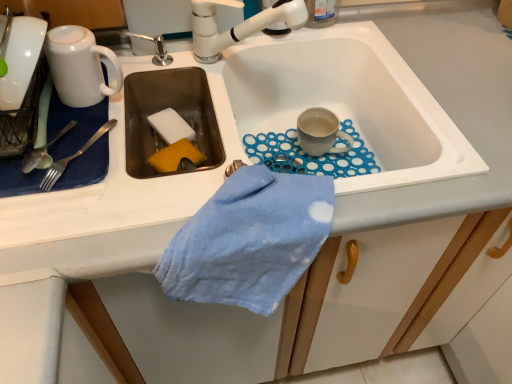
Question: Considering the relative positions of satin silver fork at left, which is the third silverware from left to right, and matte gray mug at sink right, acting as the 1th coffee cup starting from the back, in the image provided, is satin silver fork at left, which is the third silverware from left to right, to the left of matte gray mug at sink right, acting as the 1th coffee cup starting from the back, from the viewer's perspective?

Choices:
 (A) yes
 (B) no

Answer: (A)

Question: From the image's perspective, would you say satin silver fork at left, which is the third silverware from left to right, is shown under matte gray mug at sink right, which appears as the 1th coffee cup when viewed from the right?

Choices:
 (A) no
 (B) yes

Answer: (B)

Question: Does satin silver fork at left, which is the third silverware from left to right, have a greater height compared to matte gray mug at sink right, which appears as the 1th coffee cup when viewed from the right?

Choices:
 (A) yes
 (B) no

Answer: (B)

Question: Does satin silver fork at left, the first silverware from the right, come in front of matte gray mug at sink right, which is the second coffee cup in left-to-right order?

Choices:
 (A) no
 (B) yes

Answer: (B)

Question: Can you confirm if satin silver fork at left, the first silverware from the right, is bigger than matte gray mug at sink right, which is the second coffee cup in left-to-right order?

Choices:
 (A) no
 (B) yes

Answer: (A)

Question: Would you say satin silver fork at left, the first silverware from the right, is outside matte gray mug at sink right, which appears as the 1th coffee cup when viewed from the right?

Choices:
 (A) no
 (B) yes

Answer: (B)

Question: Is white ceramic tap at upper center in front of matte gray mug at sink right, the 2th coffee cup positioned from the front?

Choices:
 (A) no
 (B) yes

Answer: (B)

Question: Does white ceramic tap at upper center have a lesser height compared to matte gray mug at sink right, which is the second coffee cup in left-to-right order?

Choices:
 (A) no
 (B) yes

Answer: (A)

Question: Can you confirm if white ceramic tap at upper center is thinner than matte gray mug at sink right, acting as the 1th coffee cup starting from the back?

Choices:
 (A) yes
 (B) no

Answer: (B)

Question: From the image's perspective, does white ceramic tap at upper center appear lower than matte gray mug at sink right, which is the second coffee cup in left-to-right order?

Choices:
 (A) no
 (B) yes

Answer: (A)

Question: Is white ceramic tap at upper center at the left side of matte gray mug at sink right, which appears as the 1th coffee cup when viewed from the right?

Choices:
 (A) yes
 (B) no

Answer: (A)

Question: Does white ceramic tap at upper center have a greater width compared to matte gray mug at sink right, acting as the 1th coffee cup starting from the back?

Choices:
 (A) no
 (B) yes

Answer: (B)

Question: Is white ceramic tap at upper center positioned beyond the bounds of white sponge at sink left?

Choices:
 (A) no
 (B) yes

Answer: (B)